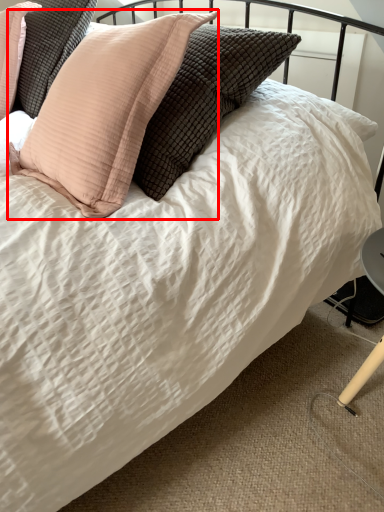
Question: From the image's perspective, considering the relative positions of pillow (annotated by the red box) and pillow in the image provided, where is pillow (annotated by the red box) located with respect to the staircase?

Choices:
 (A) below
 (B) above

Answer: (A)